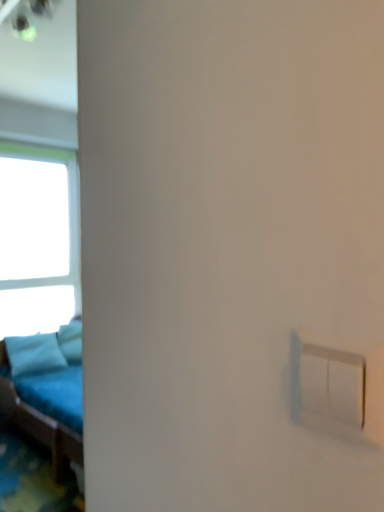
At what (x,y) coordinates should I click in order to perform the action: click on transparent glass window at upper left. Please return your answer as a coordinate pair (x, y). Image resolution: width=384 pixels, height=512 pixels. Looking at the image, I should click on coord(39,174).

Describe the element at coordinates (39, 174) in the screenshot. I see `transparent glass window at upper left` at that location.

The width and height of the screenshot is (384, 512). What are the coordinates of `transparent glass window at upper left` in the screenshot? It's located at (39, 174).